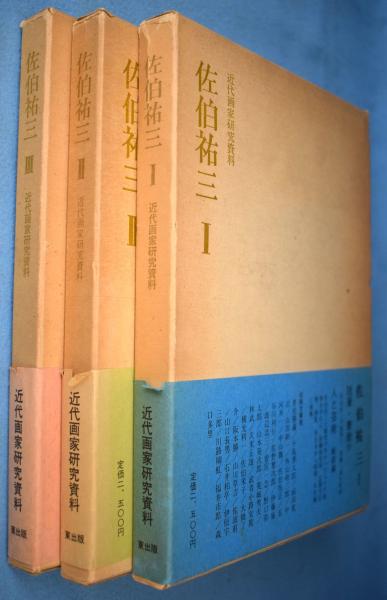
You are a GUI agent. You are given a task and a screenshot of the screen. Output one action in this format:
    pyautogui.click(x=<x>, y=<y>)
    Task: Click on the orange book covers
    This screenshot has height=600, width=387.
    Given the screenshot: What is the action you would take?
    pyautogui.click(x=230, y=326), pyautogui.click(x=107, y=335), pyautogui.click(x=47, y=326)